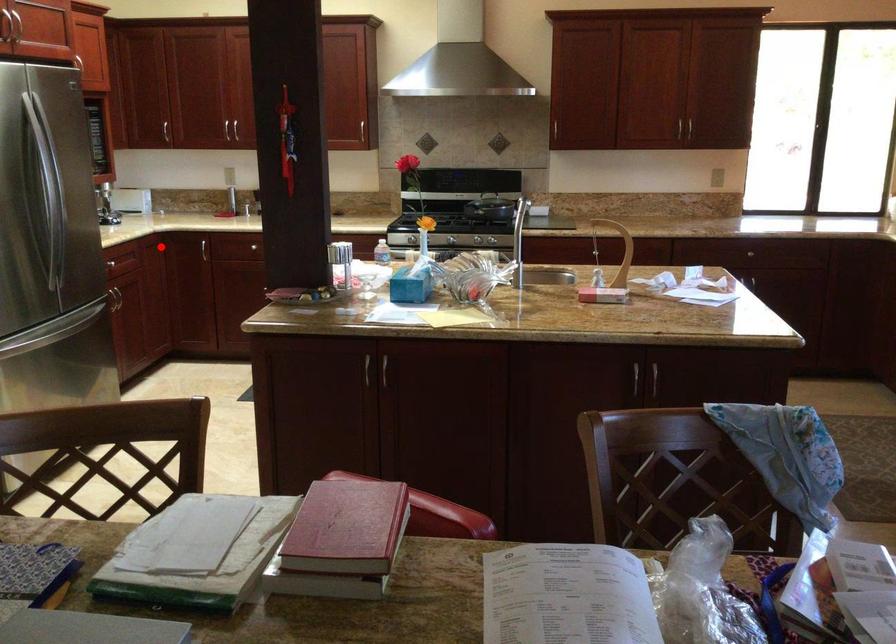
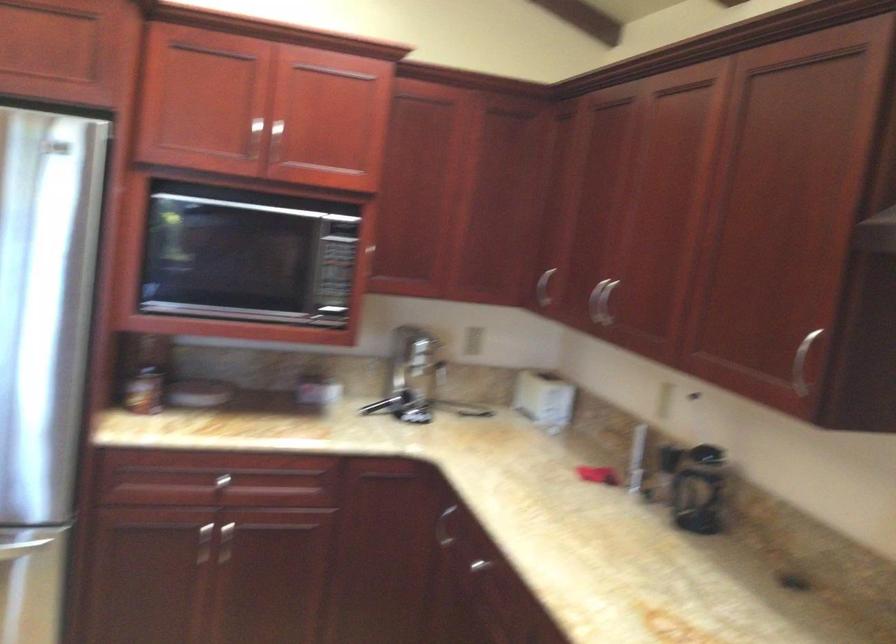
Where in the second image is the point corresponding to the highlighted location from the first image?

(444, 527)